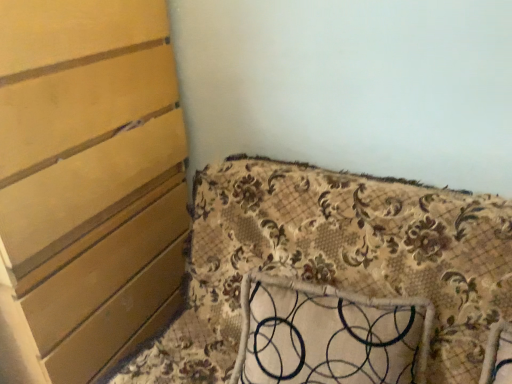
Question: Considering the relative positions of matte wood chest of drawers at left and floral fabric pillow at center in the image provided, is matte wood chest of drawers at left behind floral fabric pillow at center?

Choices:
 (A) yes
 (B) no

Answer: (B)

Question: From the image's perspective, would you say matte wood chest of drawers at left is positioned over floral fabric pillow at center?

Choices:
 (A) yes
 (B) no

Answer: (A)

Question: Is there a large distance between matte wood chest of drawers at left and floral fabric pillow at center?

Choices:
 (A) no
 (B) yes

Answer: (A)

Question: Is matte wood chest of drawers at left oriented away from floral fabric pillow at center?

Choices:
 (A) yes
 (B) no

Answer: (B)

Question: Is matte wood chest of drawers at left to the right of floral fabric pillow at center from the viewer's perspective?

Choices:
 (A) no
 (B) yes

Answer: (A)

Question: Is matte wood chest of drawers at left at the left side of floral fabric pillow at center?

Choices:
 (A) yes
 (B) no

Answer: (A)

Question: Is floral fabric pillow at center smaller than floral fabric cushion at lower right?

Choices:
 (A) no
 (B) yes

Answer: (B)

Question: Is the depth of floral fabric pillow at center greater than that of floral fabric cushion at lower right?

Choices:
 (A) yes
 (B) no

Answer: (A)

Question: From a real-world perspective, is floral fabric pillow at center on top of floral fabric cushion at lower right?

Choices:
 (A) no
 (B) yes

Answer: (A)

Question: Is floral fabric pillow at center placed right next to floral fabric cushion at lower right?

Choices:
 (A) yes
 (B) no

Answer: (B)

Question: Is the position of floral fabric pillow at center less distant than that of floral fabric cushion at lower right?

Choices:
 (A) yes
 (B) no

Answer: (B)

Question: Is floral fabric pillow at center looking in the opposite direction of floral fabric cushion at lower right?

Choices:
 (A) no
 (B) yes

Answer: (B)

Question: Does matte wood chest of drawers at left have a greater width compared to floral fabric cushion at lower right?

Choices:
 (A) no
 (B) yes

Answer: (A)